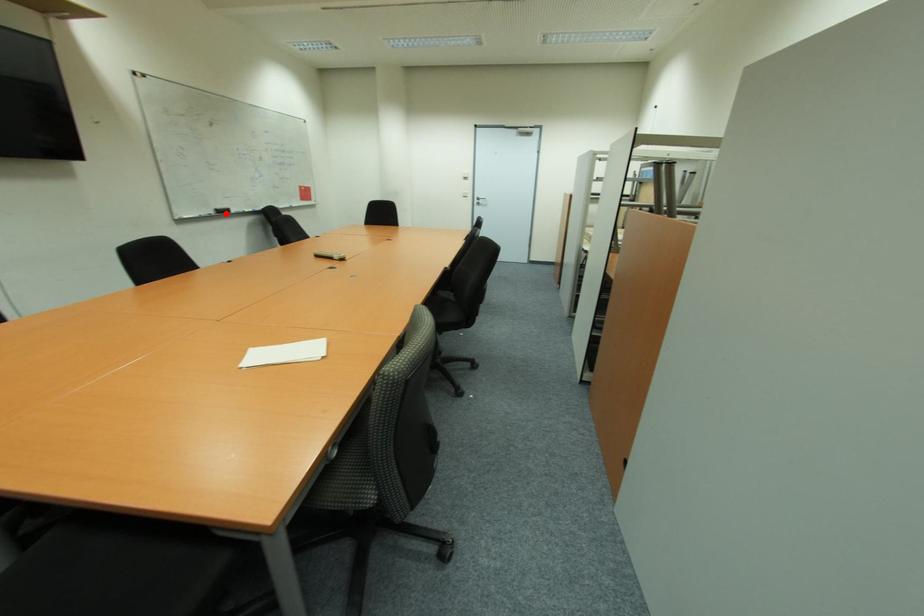
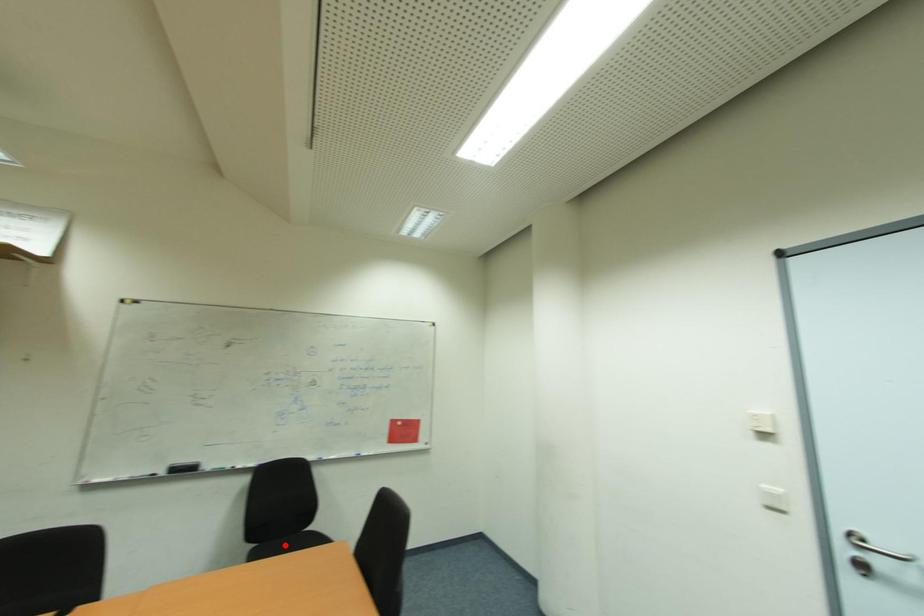
I am providing you with two images of the same scene from different viewpoints. A red point is marked on the first image and another point is marked on the second image. Is the red point in image1 aligned with the point shown in image2?

No